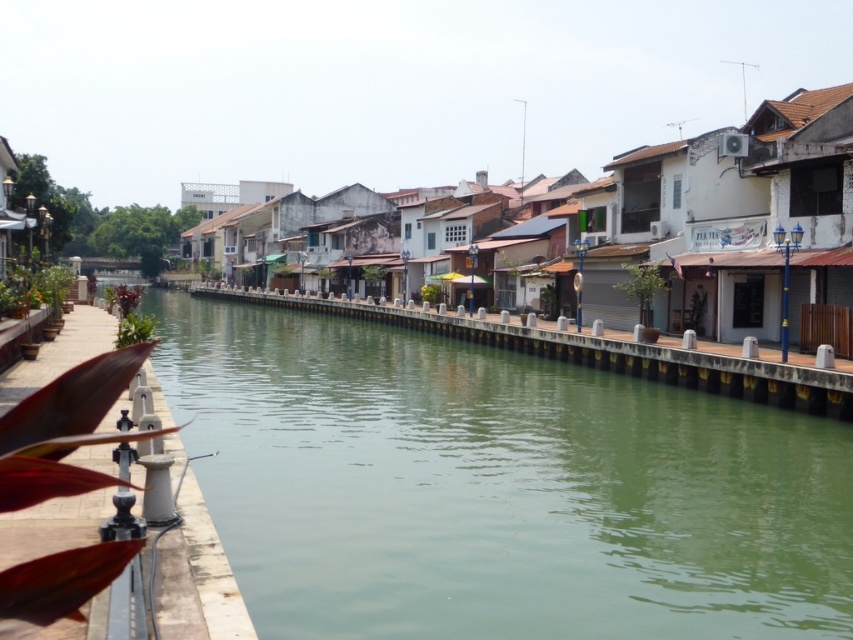
In the scene shown: Can you confirm if green smooth water at center is positioned to the right of white concrete dock at lower left?

Correct, you'll find green smooth water at center to the right of white concrete dock at lower left.

You are a GUI agent. You are given a task and a screenshot of the screen. Output one action in this format:
    pyautogui.click(x=<x>, y=<y>)
    Task: Click on the green smooth water at center
    Image resolution: width=853 pixels, height=640 pixels.
    Given the screenshot: What is the action you would take?
    pyautogui.click(x=497, y=486)

Where is `green smooth water at center`? The image size is (853, 640). green smooth water at center is located at coordinates (497, 486).

Between point (64, 336) and point (279, 305), which one is positioned behind?

The point (279, 305) is behind.

Can you confirm if white concrete dock at lower left is positioned to the left of smooth concrete railing at center?

Indeed, white concrete dock at lower left is positioned on the left side of smooth concrete railing at center.

Does point (18, 538) come farther from viewer compared to point (334, 310)?

No, it is in front of (334, 310).

You are a GUI agent. You are given a task and a screenshot of the screen. Output one action in this format:
    pyautogui.click(x=<x>, y=<y>)
    Task: Click on the white concrete dock at lower left
    
    Given the screenshot: What is the action you would take?
    pyautogui.click(x=196, y=577)

Is green smooth water at center smaller than smooth concrete railing at center?

Indeed, green smooth water at center has a smaller size compared to smooth concrete railing at center.

Between point (360, 509) and point (312, 310), which one is positioned in front?

Point (360, 509) is more forward.

This screenshot has width=853, height=640. What do you see at coordinates (497, 486) in the screenshot? I see `green smooth water at center` at bounding box center [497, 486].

Identify the location of green smooth water at center. (497, 486).